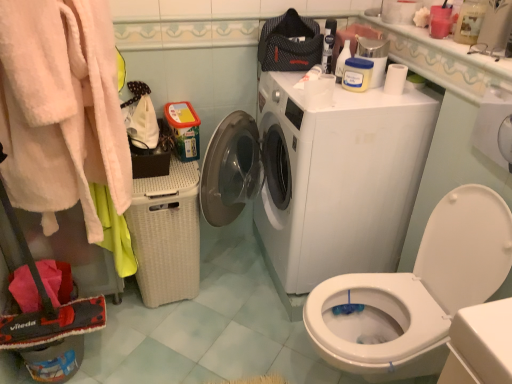
Identify the location of free spot behind white matte toilet paper at upper right, arranged as the 2th toilet paper when viewed from the back. Image resolution: width=512 pixels, height=384 pixels. (316, 93).